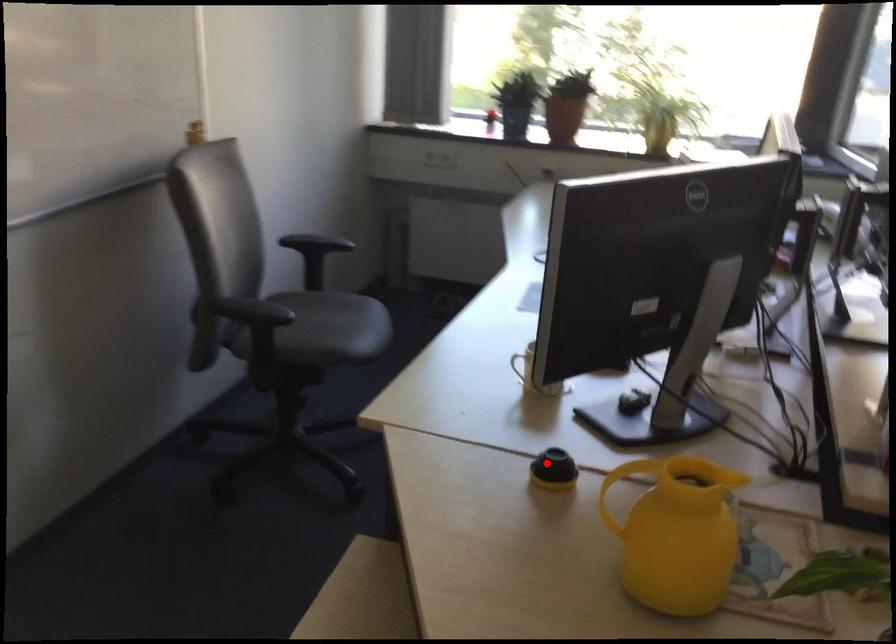
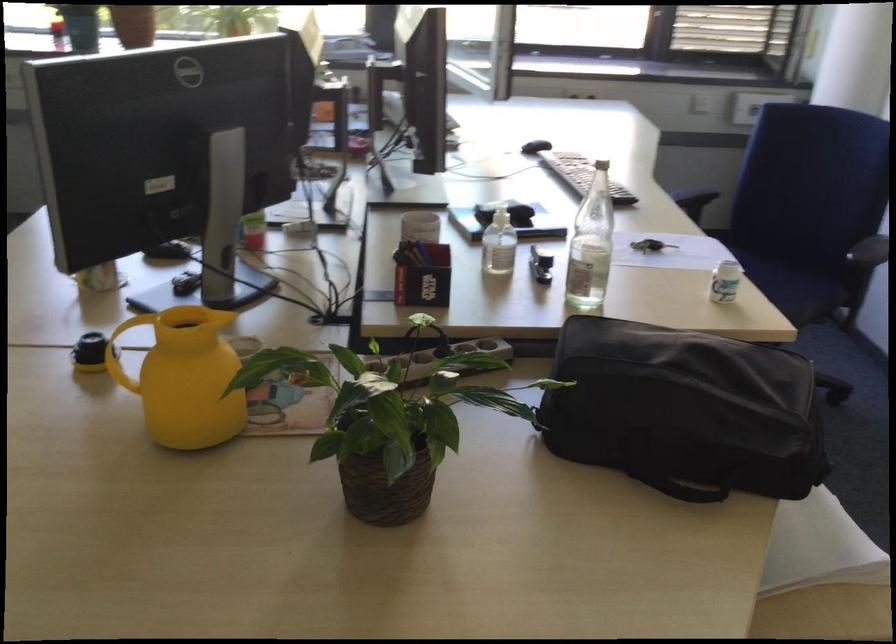
Find the pixel in the second image that matches the highlighted location in the first image.

(90, 352)